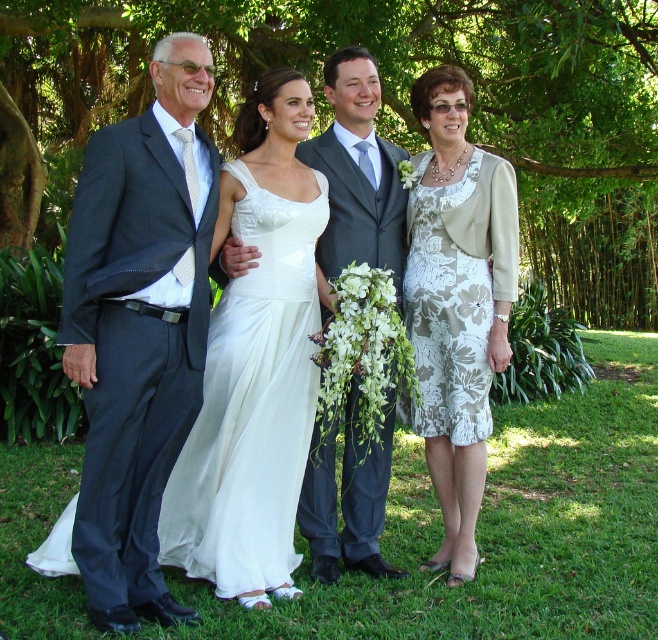
Question: Can you confirm if white satin dress at center is positioned below matte gray suit at center?

Choices:
 (A) no
 (B) yes

Answer: (B)

Question: In this image, where is green leafy tree at upper center located relative to white satin dress at center?

Choices:
 (A) above
 (B) below

Answer: (A)

Question: Which object appears closest to the camera in this image?

Choices:
 (A) matte gray suit at center
 (B) green leafy tree at upper center

Answer: (A)

Question: Which object is positioned closest to the matte gray suit at center?

Choices:
 (A) green leafy tree at upper center
 (B) dark gray suit at left

Answer: (B)

Question: Which of the following is the closest to the observer?

Choices:
 (A) (455, 410)
 (B) (201, 198)
 (C) (193, 428)
 (D) (432, 403)

Answer: (B)

Question: Is green leafy tree at upper center further to the viewer compared to floral-patterned fabric dress at right?

Choices:
 (A) yes
 (B) no

Answer: (A)